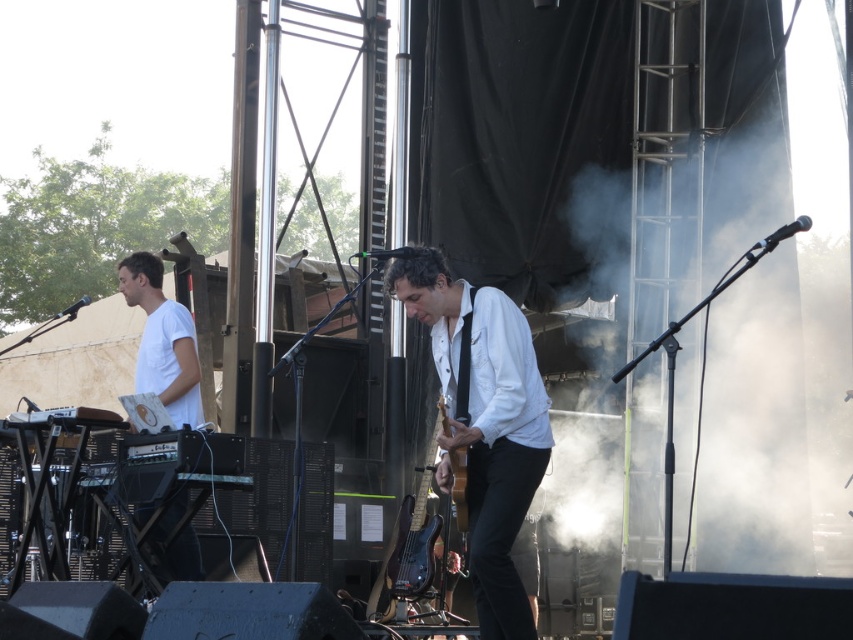
You are a photographer at the live music event. You need to capture a closeup shot of the keyboardist wearing a white T shirt. The stage is quite dark, so you have to use a flash. However, the flash might reflect off the laptop screen. Where should you position your camera relative to the keyboardist to minimize reflection? Remember, the white matte shirt at left is at point (161, 340).

Position the camera so that it is on the opposite side of the keyboardist from the white matte shirt at left. This placement reduces the chance of the flash reflecting off the laptop screen.

You are a photographer at the event and need to capture a closeup shot of both the white matte shirt at center and the wooden acoustic guitar at center. Since your camera can only focus on one subject at a time, which object should you choose to ensure it appears larger in the photo?

The white matte shirt at center is bigger than the wooden acoustic guitar at center, so you should focus on the white matte shirt at center to ensure it appears larger in the photo.

You are attending a live music performance and want to take a photo of the white matte shirt at center. If your camera has a maximum focus range of 8 meters, will you be able to capture a clear photo?

The white matte shirt at center is 7.88 meters away from viewer, so yes, the camera can focus on it since the distance is within the 8 meters range.